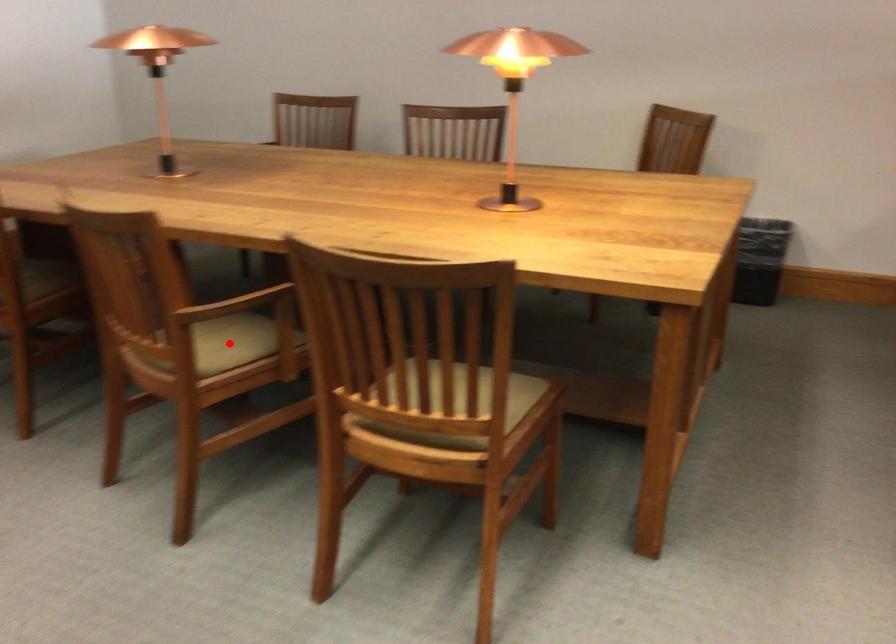
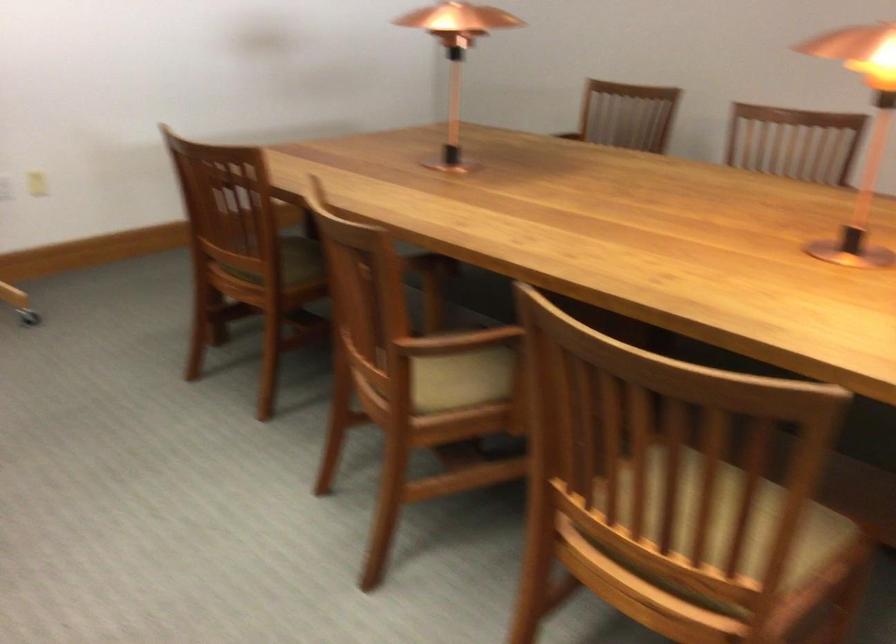
Where in the second image is the point corresponding to the highlighted location from the first image?

(460, 377)